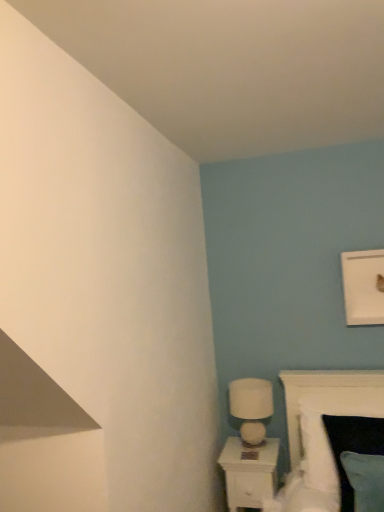
Question: From a real-world perspective, is white glossy nightstand at lower right positioned over white soft bed at lower right based on gravity?

Choices:
 (A) no
 (B) yes

Answer: (A)

Question: Is white glossy nightstand at lower right next to white soft bed at lower right and touching it?

Choices:
 (A) no
 (B) yes

Answer: (A)

Question: Is white glossy nightstand at lower right to the left of white soft bed at lower right from the viewer's perspective?

Choices:
 (A) no
 (B) yes

Answer: (B)

Question: Is white glossy nightstand at lower right shorter than white soft bed at lower right?

Choices:
 (A) yes
 (B) no

Answer: (A)

Question: From a real-world perspective, is white glossy nightstand at lower right under white soft bed at lower right?

Choices:
 (A) yes
 (B) no

Answer: (A)

Question: Considering the positions of white glossy table lamp at lower right and white soft bed at lower right in the image, is white glossy table lamp at lower right bigger or smaller than white soft bed at lower right?

Choices:
 (A) small
 (B) big

Answer: (A)

Question: Is white glossy table lamp at lower right taller or shorter than white soft bed at lower right?

Choices:
 (A) short
 (B) tall

Answer: (A)

Question: Would you say white glossy table lamp at lower right is inside or outside white soft bed at lower right?

Choices:
 (A) outside
 (B) inside

Answer: (A)

Question: Is point (248, 437) positioned closer to the camera than point (314, 461)?

Choices:
 (A) closer
 (B) farther

Answer: (B)

Question: From a real-world perspective, is white glossy nightstand at lower right positioned above or below white soft bed at lower right?

Choices:
 (A) below
 (B) above

Answer: (A)

Question: In terms of height, does white glossy nightstand at lower right look taller or shorter compared to white soft bed at lower right?

Choices:
 (A) tall
 (B) short

Answer: (B)

Question: From the image's perspective, is white glossy nightstand at lower right located above or below white soft bed at lower right?

Choices:
 (A) below
 (B) above

Answer: (A)

Question: Based on their sizes in the image, would you say white glossy nightstand at lower right is bigger or smaller than white soft bed at lower right?

Choices:
 (A) big
 (B) small

Answer: (B)

Question: Is white soft bed at lower right wider or thinner than white glossy table lamp at lower right?

Choices:
 (A) thin
 (B) wide

Answer: (B)

Question: From the image's perspective, is white soft bed at lower right located above or below white glossy table lamp at lower right?

Choices:
 (A) above
 (B) below

Answer: (B)